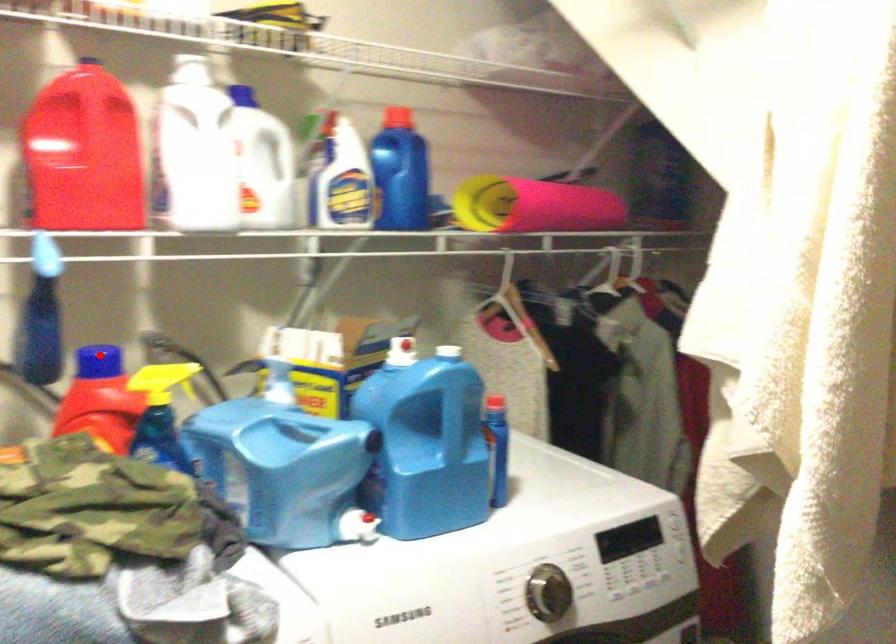
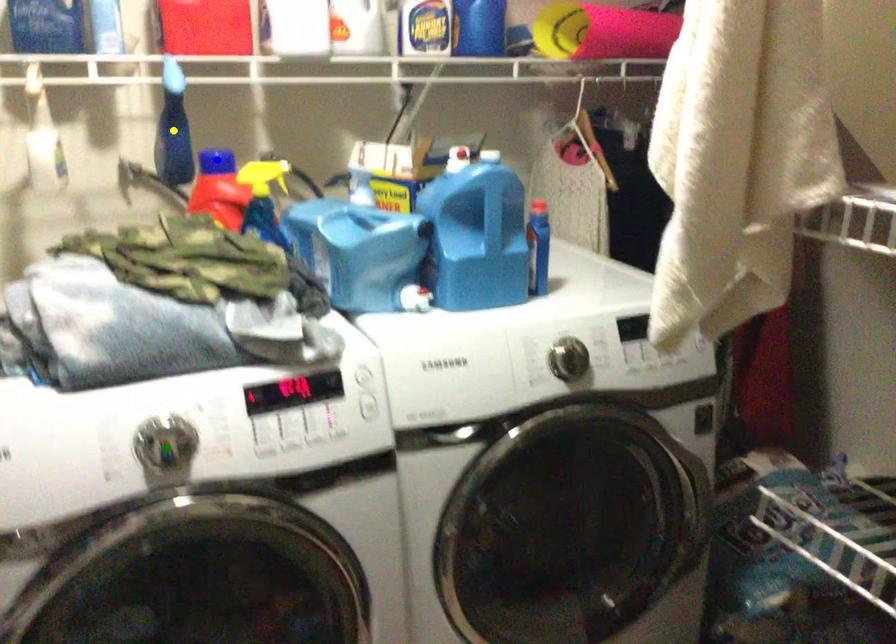
Question: I am providing you with two images of the same scene from different viewpoints. A red point is marked on the first image. You are given multiple points on the second image. Which point in image 2 is actually the same real-world point as the red point in image 1?

Choices:
 (A) yellow point
 (B) blue point
 (C) green point

Answer: (B)